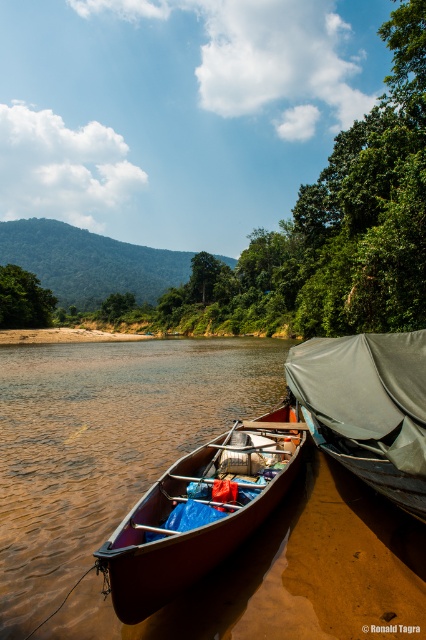
Question: Can you confirm if wooden canoe at center is positioned above dark gray tarpaulin boat at right?

Choices:
 (A) yes
 (B) no

Answer: (B)

Question: Can you confirm if wooden canoe at center is wider than dark gray tarpaulin boat at right?

Choices:
 (A) no
 (B) yes

Answer: (B)

Question: Is wooden canoe at center above dark gray tarpaulin boat at right?

Choices:
 (A) no
 (B) yes

Answer: (A)

Question: Which object is closer to the camera taking this photo?

Choices:
 (A) dark gray tarpaulin boat at right
 (B) wooden canoe at center

Answer: (B)